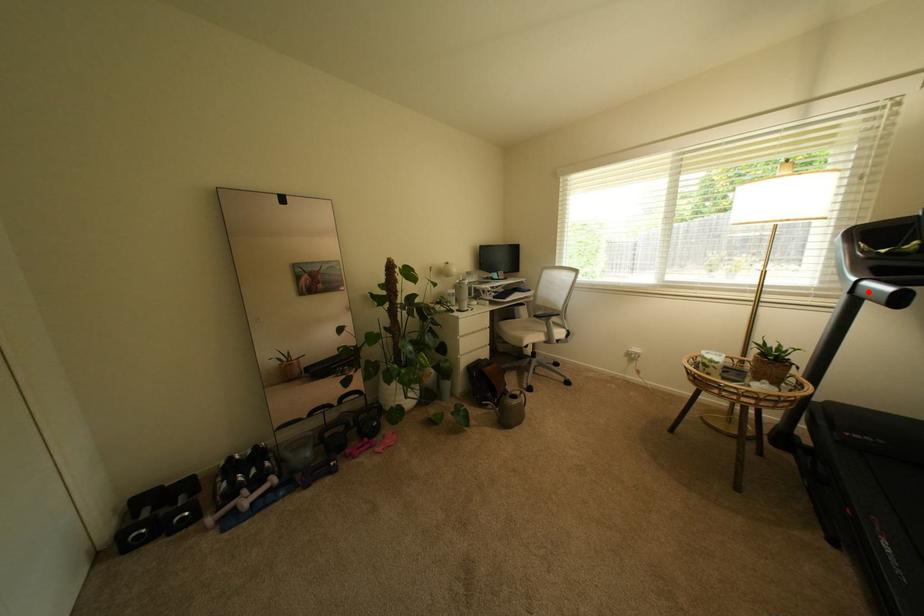
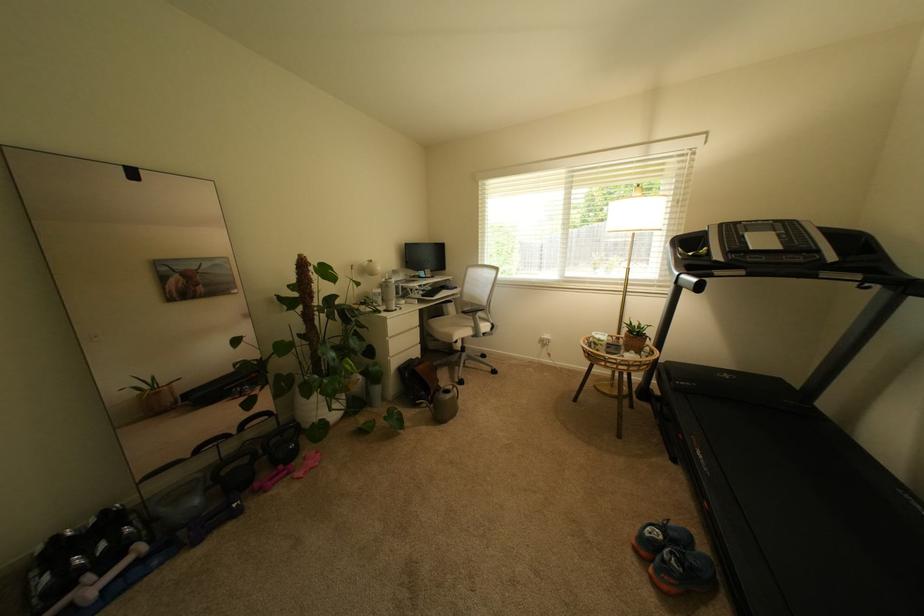
Where in the second image is the point corresponding to the highlighted location from the first image?

(688, 283)